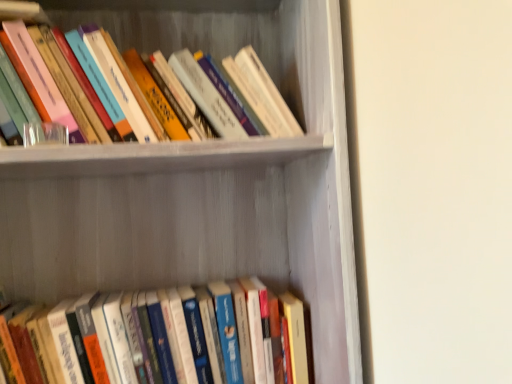
Locate an element on the screen. This screenshot has height=384, width=512. hardcover books at upper left, which ranks as the first book in top-to-bottom order is located at coordinates (176, 24).

Image resolution: width=512 pixels, height=384 pixels. What do you see at coordinates (158, 337) in the screenshot?
I see `hardcover books at lower center, placed as the second book when sorted from top to bottom` at bounding box center [158, 337].

The width and height of the screenshot is (512, 384). I want to click on white matte bookshelf at upper center, so click(x=202, y=187).

Which object is positioned more to the right, white matte bookshelf at upper center or hardcover books at upper left, which is the 2th book from bottom to top?

white matte bookshelf at upper center.

In terms of width, does white matte bookshelf at upper center look wider or thinner when compared to hardcover books at upper left, which ranks as the first book in top-to-bottom order?

white matte bookshelf at upper center is wider than hardcover books at upper left, which ranks as the first book in top-to-bottom order.

Can you confirm if white matte bookshelf at upper center is bigger than hardcover books at upper left, which is the 2th book from bottom to top?

Correct, white matte bookshelf at upper center is larger in size than hardcover books at upper left, which is the 2th book from bottom to top.

Where is `shelf in front of the hardcover books at upper left, which ranks as the first book in top-to-bottom order`? shelf in front of the hardcover books at upper left, which ranks as the first book in top-to-bottom order is located at coordinates (202, 187).

From the image's perspective, is white matte bookshelf at upper center located above or below hardcover books at lower center, positioned as the 1th book in bottom-to-top order?

white matte bookshelf at upper center is situated higher than hardcover books at lower center, positioned as the 1th book in bottom-to-top order, in the image.

Between white matte bookshelf at upper center and hardcover books at lower center, positioned as the 1th book in bottom-to-top order, which one has smaller size?

hardcover books at lower center, positioned as the 1th book in bottom-to-top order, is smaller.

From their relative heights in the image, would you say white matte bookshelf at upper center is taller or shorter than hardcover books at lower center, placed as the second book when sorted from top to bottom?

white matte bookshelf at upper center is taller than hardcover books at lower center, placed as the second book when sorted from top to bottom.

Is white matte bookshelf at upper center looking in the opposite direction of hardcover books at lower center, positioned as the 1th book in bottom-to-top order?

Yes.

In terms of size, does hardcover books at lower center, positioned as the 1th book in bottom-to-top order, appear bigger or smaller than white matte bookshelf at upper center?

Considering their sizes, hardcover books at lower center, positioned as the 1th book in bottom-to-top order, takes up less space than white matte bookshelf at upper center.

Based on their positions, is hardcover books at lower center, positioned as the 1th book in bottom-to-top order, located to the left or right of white matte bookshelf at upper center?

Based on their positions, hardcover books at lower center, positioned as the 1th book in bottom-to-top order, is located to the left of white matte bookshelf at upper center.

Do you think hardcover books at upper left, which is the 2th book from bottom to top, is within hardcover books at lower center, positioned as the 1th book in bottom-to-top order, or outside of it?

hardcover books at upper left, which is the 2th book from bottom to top, exists outside the volume of hardcover books at lower center, positioned as the 1th book in bottom-to-top order.

Which object is more forward, hardcover books at upper left, which is the 2th book from bottom to top, or hardcover books at lower center, placed as the second book when sorted from top to bottom?

hardcover books at upper left, which is the 2th book from bottom to top.

Is hardcover books at upper left, which ranks as the first book in top-to-bottom order, facing towards hardcover books at lower center, placed as the second book when sorted from top to bottom?

No, hardcover books at upper left, which ranks as the first book in top-to-bottom order, is not facing towards hardcover books at lower center, placed as the second book when sorted from top to bottom.

The width and height of the screenshot is (512, 384). Find the location of `book located underneath the hardcover books at upper left, which ranks as the first book in top-to-bottom order (from a real-world perspective)`. book located underneath the hardcover books at upper left, which ranks as the first book in top-to-bottom order (from a real-world perspective) is located at coordinates (158, 337).

Based on the photo, from a real-world perspective, relative to white matte bookshelf at upper center, is hardcover books at upper left, which ranks as the first book in top-to-bottom order, vertically above or below?

In terms of real-world spatial position, hardcover books at upper left, which ranks as the first book in top-to-bottom order, is above white matte bookshelf at upper center.

Considering the positions of objects hardcover books at upper left, which is the 2th book from bottom to top, and white matte bookshelf at upper center in the image provided, who is more to the left, hardcover books at upper left, which is the 2th book from bottom to top, or white matte bookshelf at upper center?

hardcover books at upper left, which is the 2th book from bottom to top.

Considering the positions of point (42, 6) and point (306, 191), is point (42, 6) closer or farther from the camera than point (306, 191)?

Point (42, 6).

Does hardcover books at upper left, which ranks as the first book in top-to-bottom order, come in front of white matte bookshelf at upper center?

No, it is not.

From the image's perspective, which object appears higher, hardcover books at lower center, positioned as the 1th book in bottom-to-top order, or hardcover books at upper left, which ranks as the first book in top-to-bottom order?

hardcover books at upper left, which ranks as the first book in top-to-bottom order, appears higher in the image.

Is hardcover books at lower center, positioned as the 1th book in bottom-to-top order, not within hardcover books at upper left, which is the 2th book from bottom to top?

Absolutely, hardcover books at lower center, positioned as the 1th book in bottom-to-top order, is external to hardcover books at upper left, which is the 2th book from bottom to top.

Consider the image. Measure the distance from hardcover books at lower center, placed as the second book when sorted from top to bottom, to hardcover books at upper left, which ranks as the first book in top-to-bottom order.

hardcover books at lower center, placed as the second book when sorted from top to bottom, is 21.64 inches away from hardcover books at upper left, which ranks as the first book in top-to-bottom order.

Which is closer to the camera, (76, 379) or (229, 6)?

The point (76, 379) is more forward.

Starting from the white matte bookshelf at upper center, which book is the 2nd one to the left? Please provide its 2D coordinates.

[(176, 24)]

What are the coordinates of `shelf on the right of the hardcover books at lower center, positioned as the 1th book in bottom-to-top order` in the screenshot? It's located at (202, 187).

Estimate the real-world distances between objects in this image. Which object is further from hardcover books at upper left, which is the 2th book from bottom to top, hardcover books at lower center, placed as the second book when sorted from top to bottom, or white matte bookshelf at upper center?

hardcover books at lower center, placed as the second book when sorted from top to bottom.

From the image, which object appears to be farther from hardcover books at lower center, positioned as the 1th book in bottom-to-top order, white matte bookshelf at upper center or hardcover books at upper left, which ranks as the first book in top-to-bottom order?

hardcover books at upper left, which ranks as the first book in top-to-bottom order, is further to hardcover books at lower center, positioned as the 1th book in bottom-to-top order.

Looking at the image, which one is located further to white matte bookshelf at upper center, hardcover books at upper left, which ranks as the first book in top-to-bottom order, or hardcover books at lower center, placed as the second book when sorted from top to bottom?

The object further to white matte bookshelf at upper center is hardcover books at lower center, placed as the second book when sorted from top to bottom.

Which object lies further to the anchor point hardcover books at upper left, which is the 2th book from bottom to top, white matte bookshelf at upper center or hardcover books at lower center, positioned as the 1th book in bottom-to-top order?

hardcover books at lower center, positioned as the 1th book in bottom-to-top order, is further to hardcover books at upper left, which is the 2th book from bottom to top.

Based on their spatial positions, is hardcover books at upper left, which is the 2th book from bottom to top, or white matte bookshelf at upper center closer to hardcover books at lower center, placed as the second book when sorted from top to bottom?

white matte bookshelf at upper center is closer to hardcover books at lower center, placed as the second book when sorted from top to bottom.

When comparing their distances from white matte bookshelf at upper center, does hardcover books at lower center, positioned as the 1th book in bottom-to-top order, or hardcover books at upper left, which ranks as the first book in top-to-bottom order, seem further?

hardcover books at lower center, positioned as the 1th book in bottom-to-top order, is positioned further to the anchor white matte bookshelf at upper center.

This screenshot has width=512, height=384. Find the location of `shelf between hardcover books at upper left, which ranks as the first book in top-to-bottom order, and hardcover books at lower center, positioned as the 1th book in bottom-to-top order, vertically`. shelf between hardcover books at upper left, which ranks as the first book in top-to-bottom order, and hardcover books at lower center, positioned as the 1th book in bottom-to-top order, vertically is located at coordinates (202, 187).